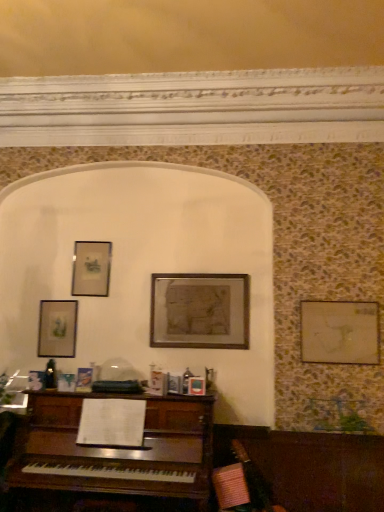
Question: From the image's perspective, is matte glass picture frame at upper left, arranged as the 1th picture frame when viewed from the left, below wooden picture frame at right, which is the 4th picture frame from left to right?

Choices:
 (A) yes
 (B) no

Answer: (A)

Question: Considering the relative sizes of matte glass picture frame at upper left, arranged as the 1th picture frame when viewed from the left, and wooden picture frame at right, which is the 4th picture frame from left to right, in the image provided, is matte glass picture frame at upper left, arranged as the 1th picture frame when viewed from the left, thinner than wooden picture frame at right, which is the 4th picture frame from left to right,?

Choices:
 (A) yes
 (B) no

Answer: (A)

Question: Is matte glass picture frame at upper left, arranged as the 1th picture frame when viewed from the left, bigger than wooden picture frame at right, which is the 4th picture frame from left to right?

Choices:
 (A) no
 (B) yes

Answer: (A)

Question: From a real-world perspective, is matte glass picture frame at upper left, which ranks as the 4th picture frame in right-to-left order, on wooden picture frame at right, which is counted as the 1th picture frame, starting from the right?

Choices:
 (A) no
 (B) yes

Answer: (A)

Question: Is matte glass picture frame at upper left, which ranks as the 4th picture frame in right-to-left order, at the right side of wooden picture frame at right, which is counted as the 1th picture frame, starting from the right?

Choices:
 (A) yes
 (B) no

Answer: (B)

Question: Can you confirm if matte glass picture frame at upper left, arranged as the 1th picture frame when viewed from the left, is wider than wooden picture frame at right, which is counted as the 1th picture frame, starting from the right?

Choices:
 (A) yes
 (B) no

Answer: (B)

Question: Is wooden framed map at center, which is counted as the 3th picture frame, starting from the left, positioned in front of matte glass picture frame at upper left, arranged as the 1th picture frame when viewed from the left?

Choices:
 (A) yes
 (B) no

Answer: (A)

Question: From the image's perspective, is wooden framed map at center, the 2th picture frame from the right, located above matte glass picture frame at upper left, arranged as the 1th picture frame when viewed from the left?

Choices:
 (A) yes
 (B) no

Answer: (A)

Question: Considering the relative sizes of wooden framed map at center, which is counted as the 3th picture frame, starting from the left, and matte glass picture frame at upper left, which ranks as the 4th picture frame in right-to-left order, in the image provided, is wooden framed map at center, which is counted as the 3th picture frame, starting from the left, smaller than matte glass picture frame at upper left, which ranks as the 4th picture frame in right-to-left order,?

Choices:
 (A) no
 (B) yes

Answer: (A)

Question: Considering the relative positions of wooden framed map at center, which is counted as the 3th picture frame, starting from the left, and matte glass picture frame at upper left, which ranks as the 4th picture frame in right-to-left order, in the image provided, is wooden framed map at center, which is counted as the 3th picture frame, starting from the left, to the left of matte glass picture frame at upper left, which ranks as the 4th picture frame in right-to-left order, from the viewer's perspective?

Choices:
 (A) yes
 (B) no

Answer: (B)

Question: Is wooden framed map at center, the 2th picture frame from the right, facing towards matte glass picture frame at upper left, which ranks as the 4th picture frame in right-to-left order?

Choices:
 (A) yes
 (B) no

Answer: (B)

Question: Is wooden framed map at center, the 2th picture frame from the right, in contact with matte glass picture frame at upper left, arranged as the 1th picture frame when viewed from the left?

Choices:
 (A) no
 (B) yes

Answer: (A)

Question: Can you confirm if matte silver picture frame at upper left, placed as the third picture frame when sorted from right to left, is smaller than wooden framed map at center, which is counted as the 3th picture frame, starting from the left?

Choices:
 (A) yes
 (B) no

Answer: (A)